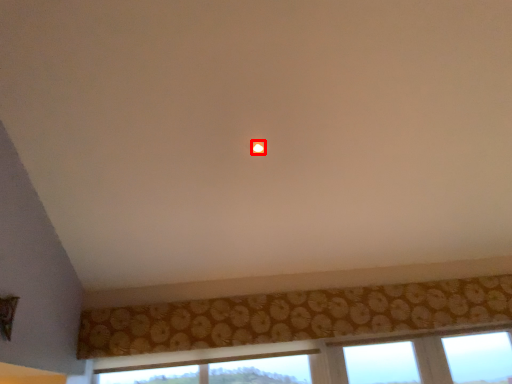
Question: From the image's perspective, what is the correct spatial relationship of glow (annotated by the red box) in relation to curtain?

Choices:
 (A) above
 (B) below

Answer: (A)